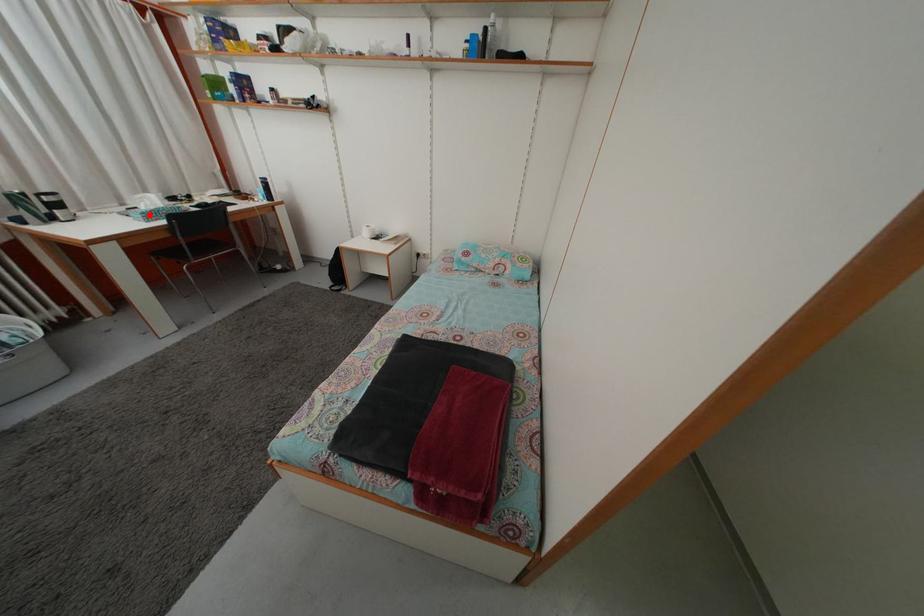
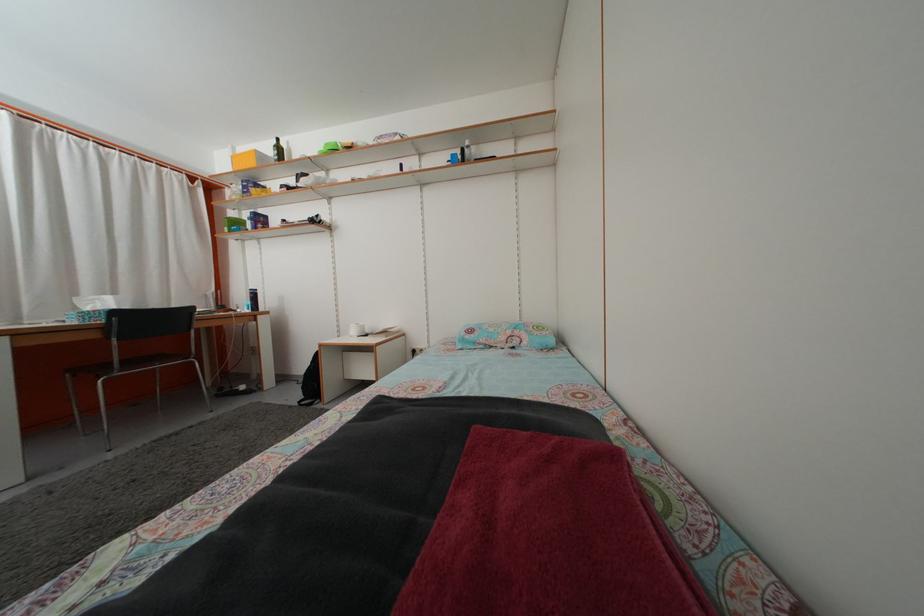
Find the pixel in the second image that matches the highlighted location in the first image.

(94, 317)